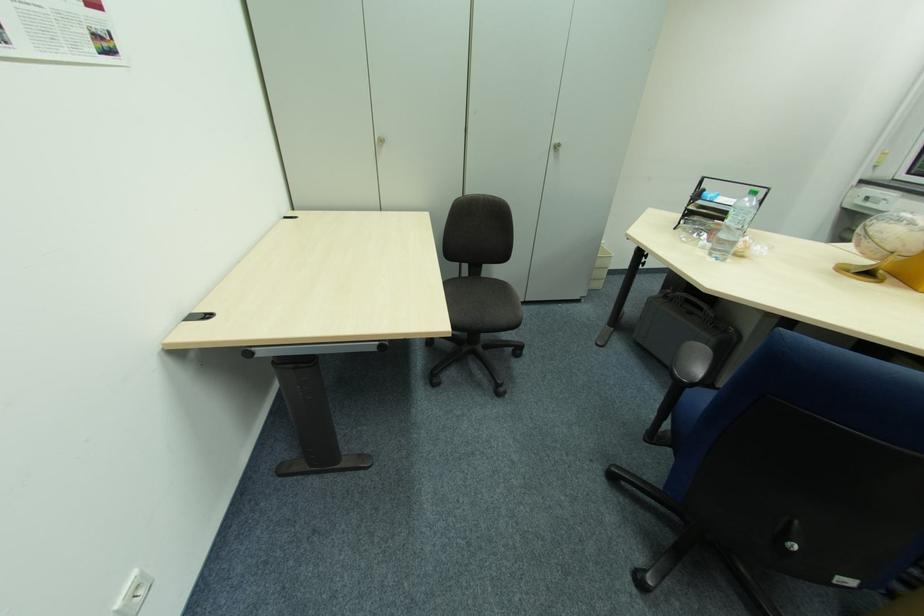
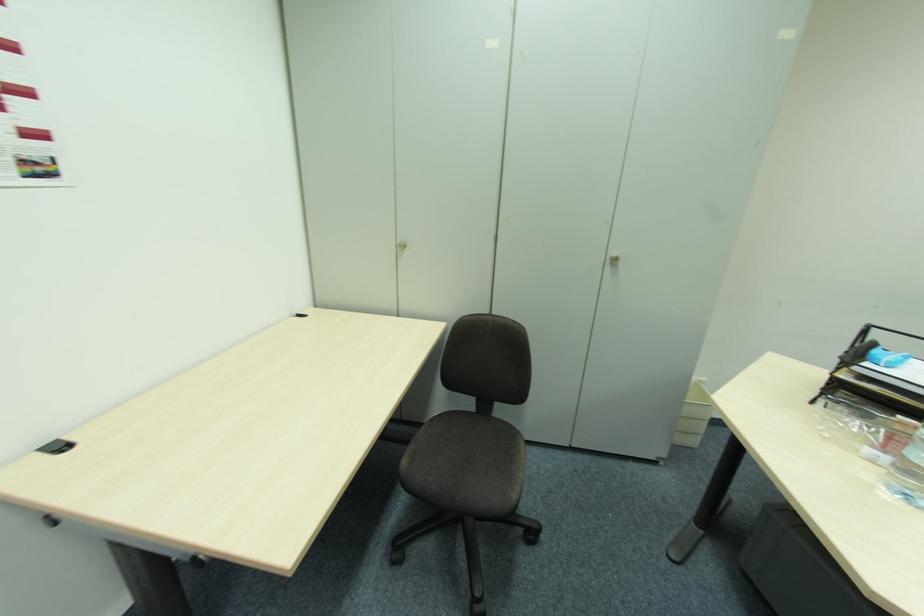
Question: The camera is either moving clockwise (left) or counter-clockwise (right) around the object. The first image is from the beginning of the video and the second image is from the end. Is the camera moving left or right when shooting the video?

Choices:
 (A) Left
 (B) Right

Answer: (B)